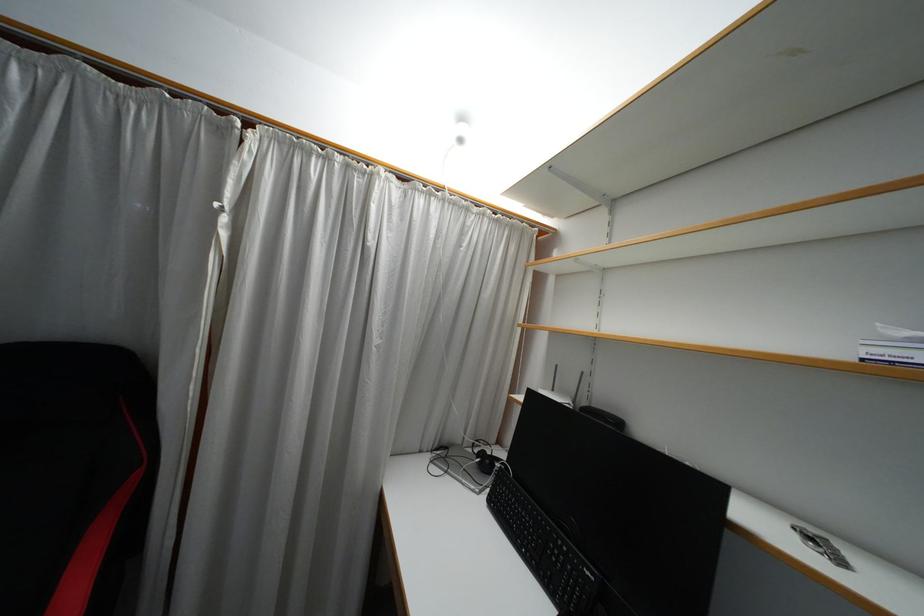
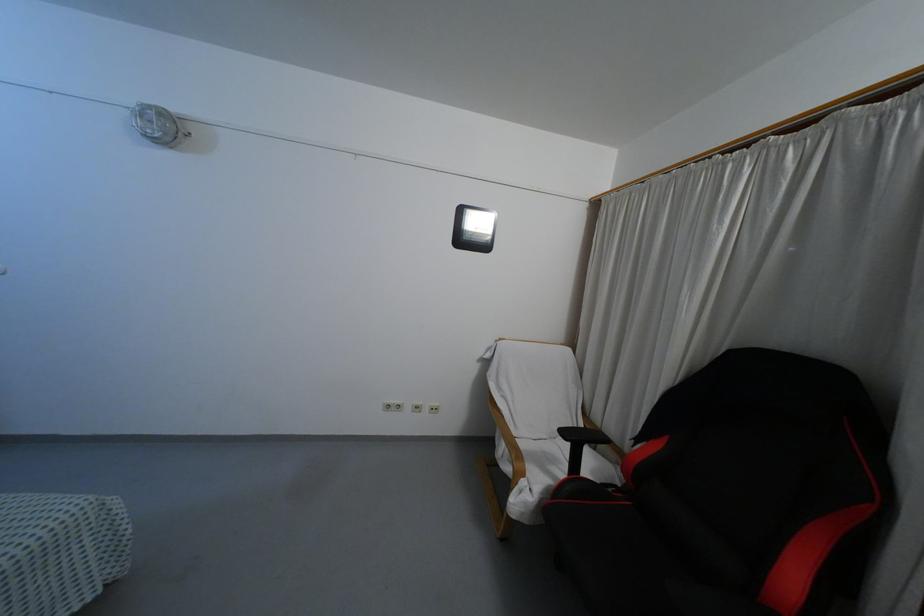
Question: The images are taken continuously from a first-person perspective. In which direction is your viewpoint rotating?

Choices:
 (A) Left
 (B) Right
 (C) Up
 (D) Down

Answer: (A)